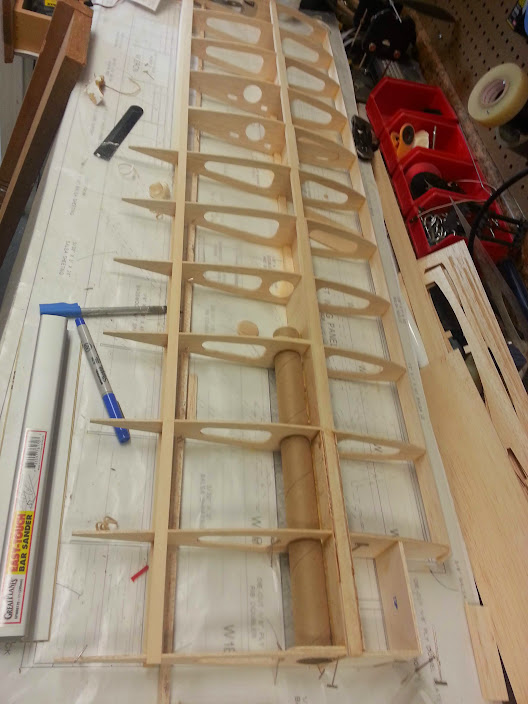
The height and width of the screenshot is (704, 528). I want to click on sharpie marker, so click(x=97, y=360).